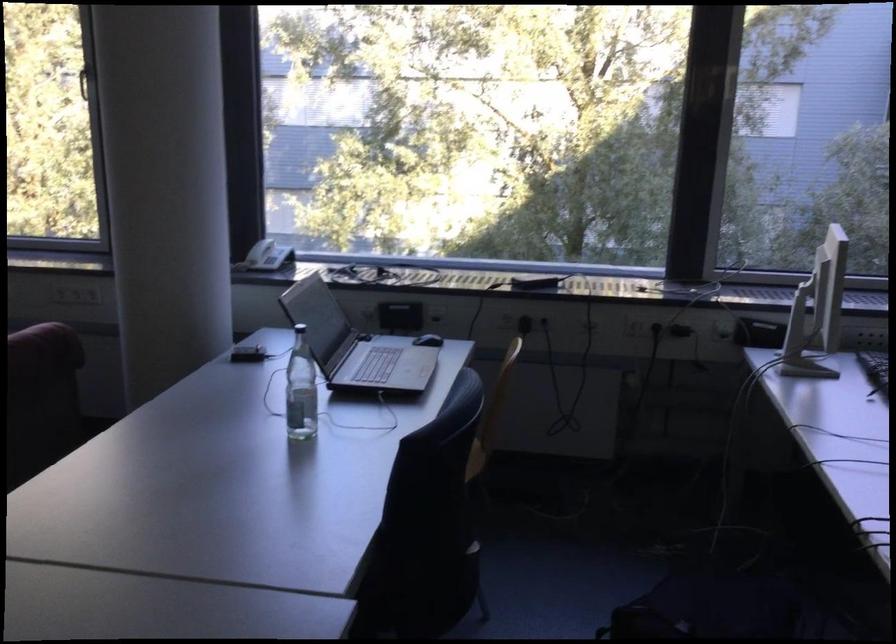
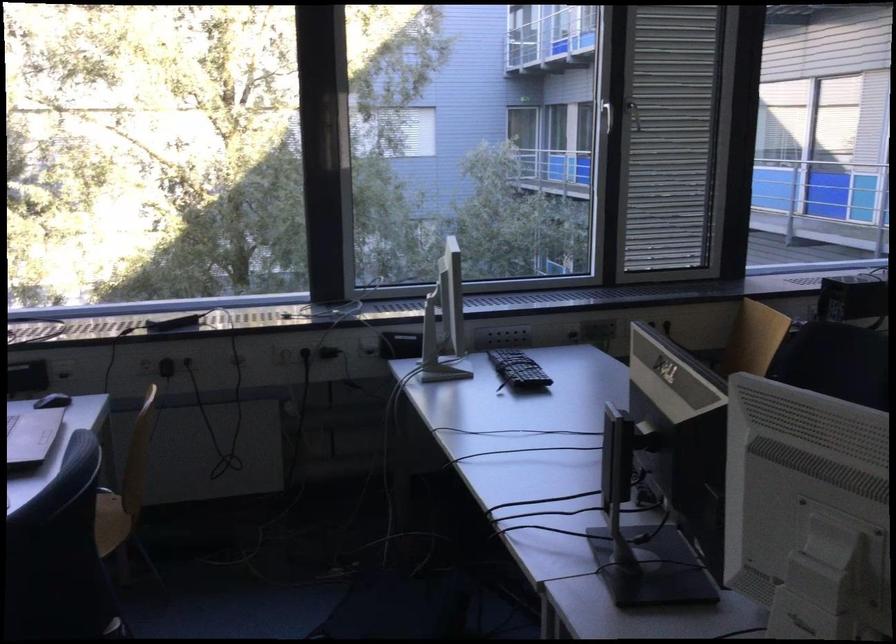
Where in the second image is the point corresponding to (x=719, y=330) from the first image?

(367, 348)